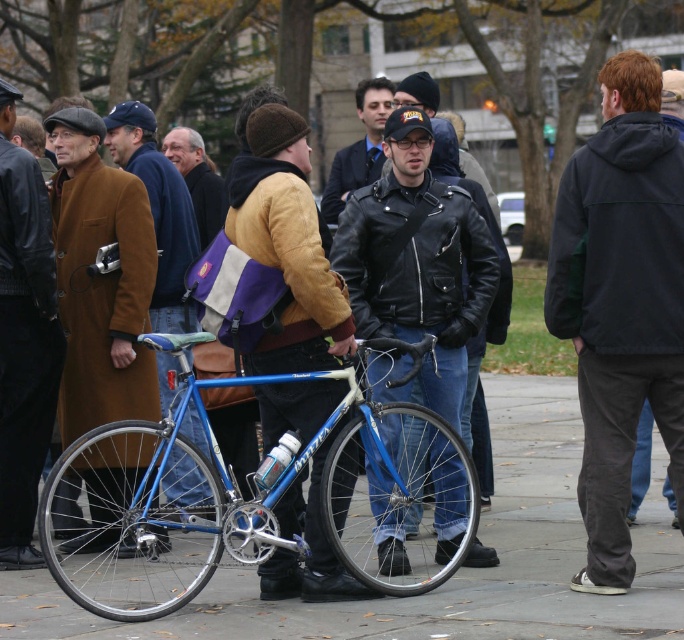
You are standing in the park and want to know which of the two points, point (68, 332) or point (328, 195), is nearer to you. Can you determine this based on the image?

Point (68, 332) is closer to the viewer than point (328, 195).

You are a photographer trying to capture both the brown leather coat at left and the leather jacket at center in a single shot. Based on their positions, which one would appear closer to the camera in your photo?

The brown leather coat at left appears closer to the camera because it is positioned under the leather jacket at center, indicating it is in front spatially.

You are a photographer positioned in the park and want to take a photo of both the brown leather coat at left and the leather jacket at center. Which object should you focus on first to ensure both are in sharp focus?

You should focus on the brown leather coat at left first because it is closer to the viewer than the leather jacket at center, so adjusting focus from near to far will help both be in sharp focus.